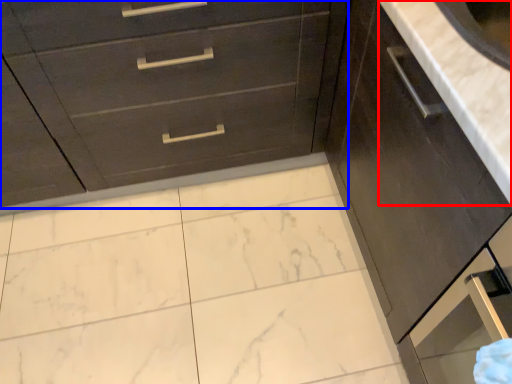
Question: Which point is closer to the camera, counter top (highlighted by a red box) or chest of drawers (highlighted by a blue box)?

Choices:
 (A) counter top
 (B) chest of drawers

Answer: (A)